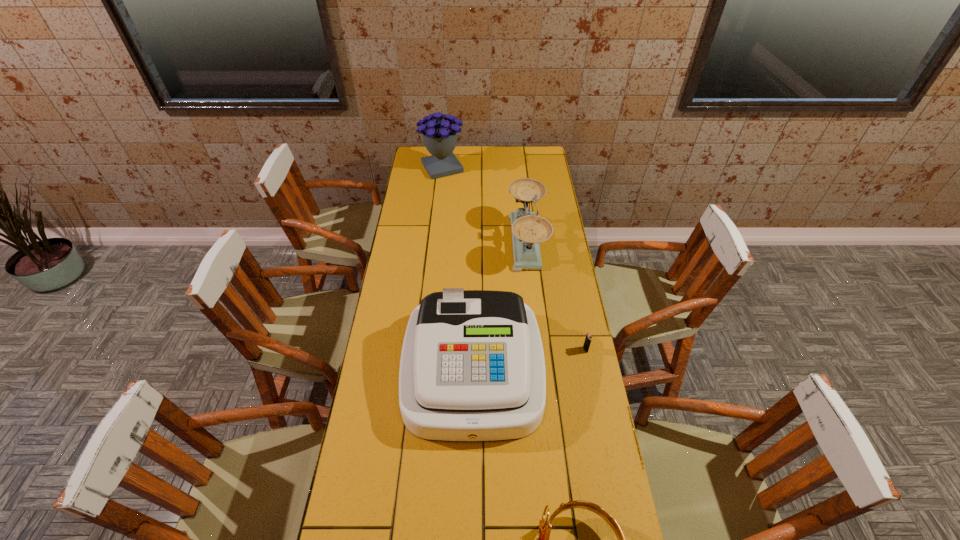
The width and height of the screenshot is (960, 540). In order to click on the farthest object in this screenshot , I will do `click(440, 137)`.

Where is `the tallest object`? This screenshot has width=960, height=540. the tallest object is located at coordinates (440, 137).

Find the location of a particular element. The height and width of the screenshot is (540, 960). the fourth nearest object is located at coordinates (528, 230).

This screenshot has width=960, height=540. I want to click on cash register, so click(472, 369).

Locate an element on the screen. the shortest object is located at coordinates (587, 342).

The width and height of the screenshot is (960, 540). Find the location of `the rightmost object`. the rightmost object is located at coordinates (587, 342).

Find the location of a particular element. free space located on the right of the farthest object is located at coordinates (504, 167).

This screenshot has width=960, height=540. What are the coordinates of `vacant space located 0.370m on the front-facing side of the fourth nearest object` in the screenshot? It's located at (423, 242).

Where is `blank space located 0.290m on the front-facing side of the fourth nearest object`? This screenshot has height=540, width=960. blank space located 0.290m on the front-facing side of the fourth nearest object is located at coordinates pyautogui.click(x=442, y=242).

I want to click on free location located 0.340m on the front-facing side of the fourth nearest object, so click(x=430, y=242).